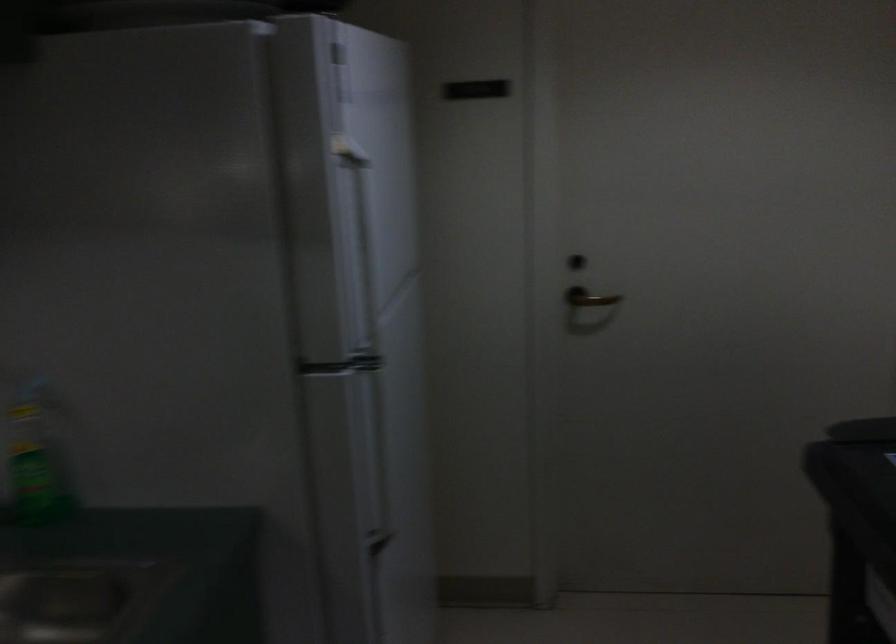
The location [30,467] corresponds to which object?

This point indicates the green spray bottle.